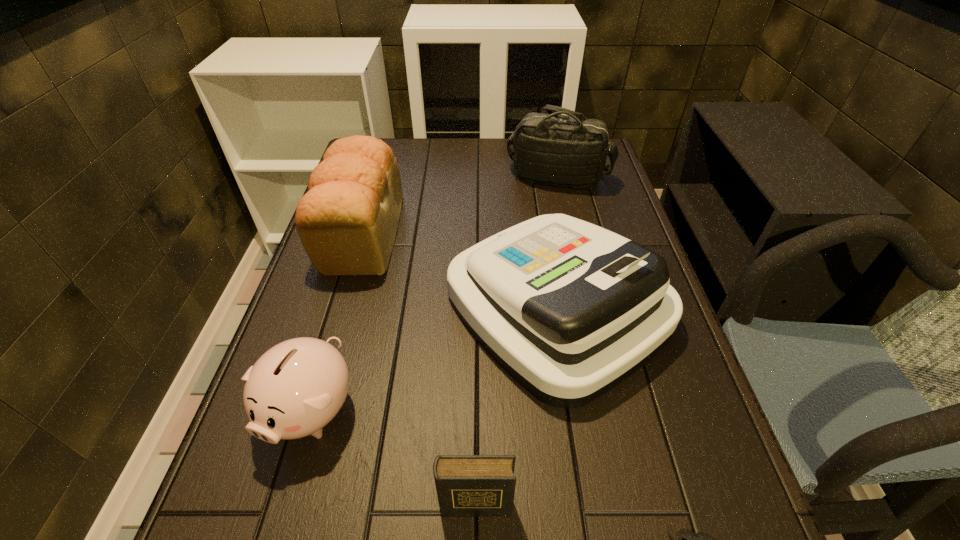
Find the location of `bread located in the left edge section of the desktop`. bread located in the left edge section of the desktop is located at coordinates (347, 222).

Where is `piggy bank that is at the left edge`? The width and height of the screenshot is (960, 540). piggy bank that is at the left edge is located at coordinates (298, 386).

The width and height of the screenshot is (960, 540). I want to click on shoulder bag located in the right edge section of the desktop, so click(x=551, y=149).

Where is `cash register that is positioned at the right edge`? Image resolution: width=960 pixels, height=540 pixels. cash register that is positioned at the right edge is located at coordinates click(x=568, y=309).

Find the location of a particular element. This screenshot has width=960, height=540. object that is at the far right corner is located at coordinates (551, 149).

In the image, there is a desktop. Identify the location of free space at the far edge. The image size is (960, 540). (440, 170).

Locate an element on the screen. free space at the near edge of the desktop is located at coordinates (449, 538).

The image size is (960, 540). I want to click on vacant area at the right edge, so click(735, 484).

Locate an element on the screen. This screenshot has width=960, height=540. empty space between the bread and the diary is located at coordinates (419, 369).

Locate an element on the screen. The width and height of the screenshot is (960, 540). empty space that is in between the bread and the shoulder bag is located at coordinates (460, 205).